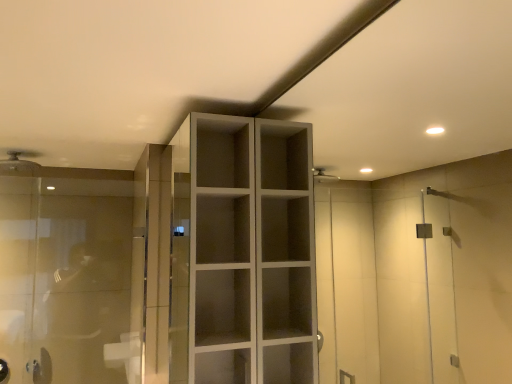
Question: Is matte white shower head at upper left taller or shorter than matte white cupboard at center?

Choices:
 (A) short
 (B) tall

Answer: (A)

Question: Which is correct: matte white shower head at upper left is inside matte white cupboard at center, or outside of it?

Choices:
 (A) inside
 (B) outside

Answer: (B)

Question: Estimate the real-world distances between objects in this image. Which object is closer to the matte white cupboard at center?

Choices:
 (A) matte white shower head at upper left
 (B) transparent glass door at left

Answer: (B)

Question: Estimate the real-world distances between objects in this image. Which object is closer to the matte white shower head at upper left?

Choices:
 (A) transparent glass door at left
 (B) matte white cupboard at center

Answer: (A)